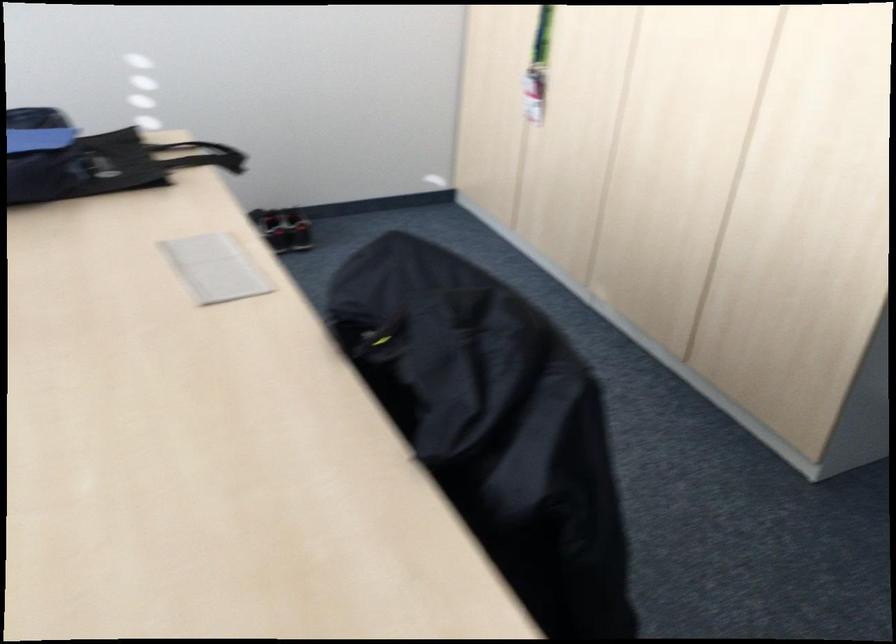
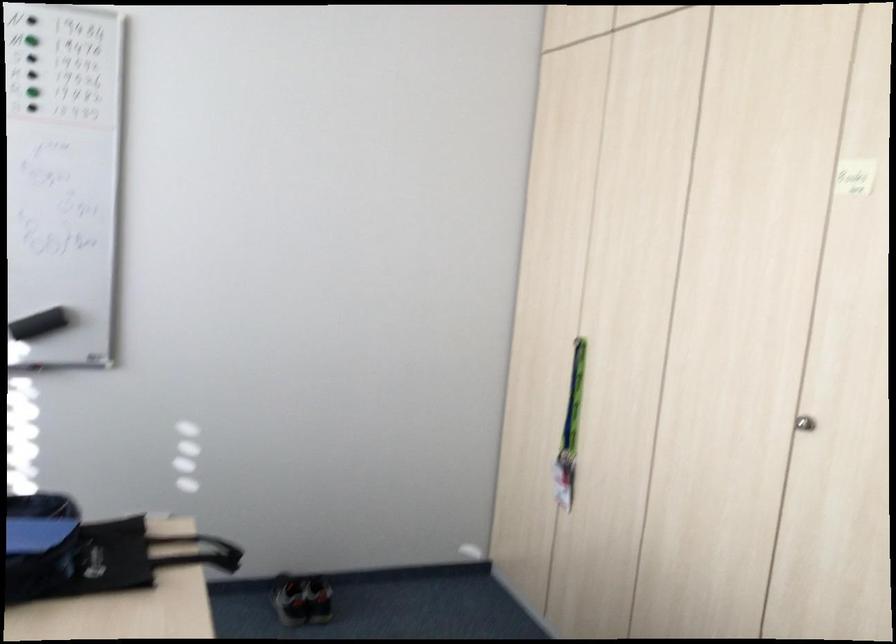
Question: The images are taken continuously from a first-person perspective. In which direction are you moving?

Choices:
 (A) Left
 (B) Right
 (C) Forward
 (D) Backward

Answer: (B)